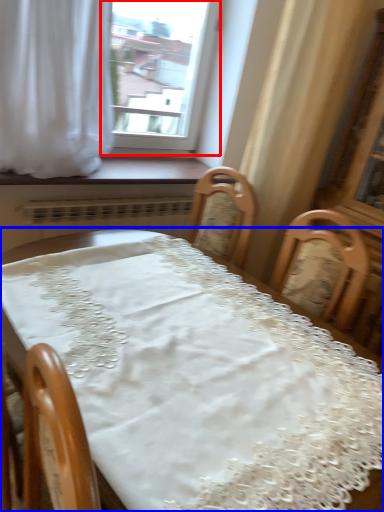
Question: Among these objects, which one is nearest to the camera, window (highlighted by a red box) or table (highlighted by a blue box)?

Choices:
 (A) window
 (B) table

Answer: (B)